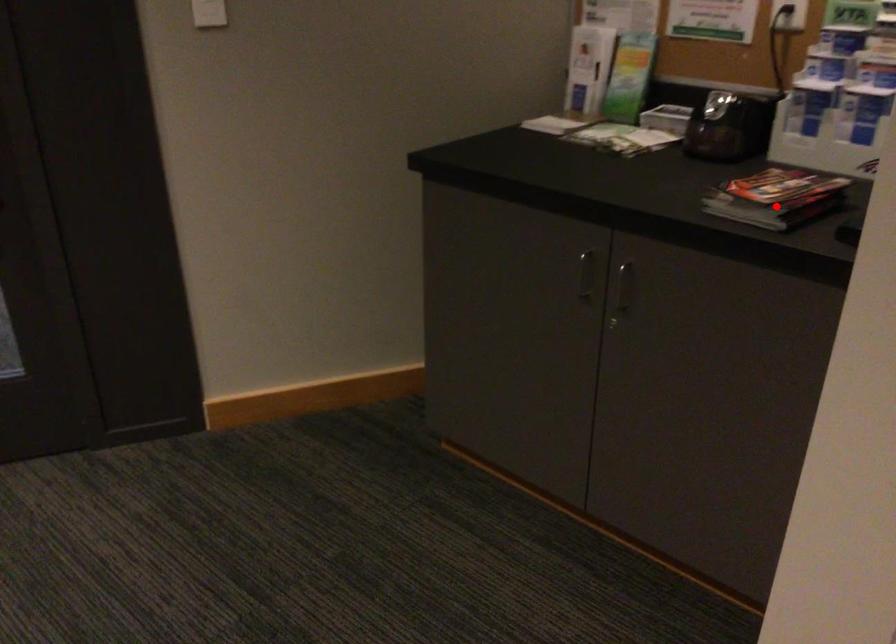
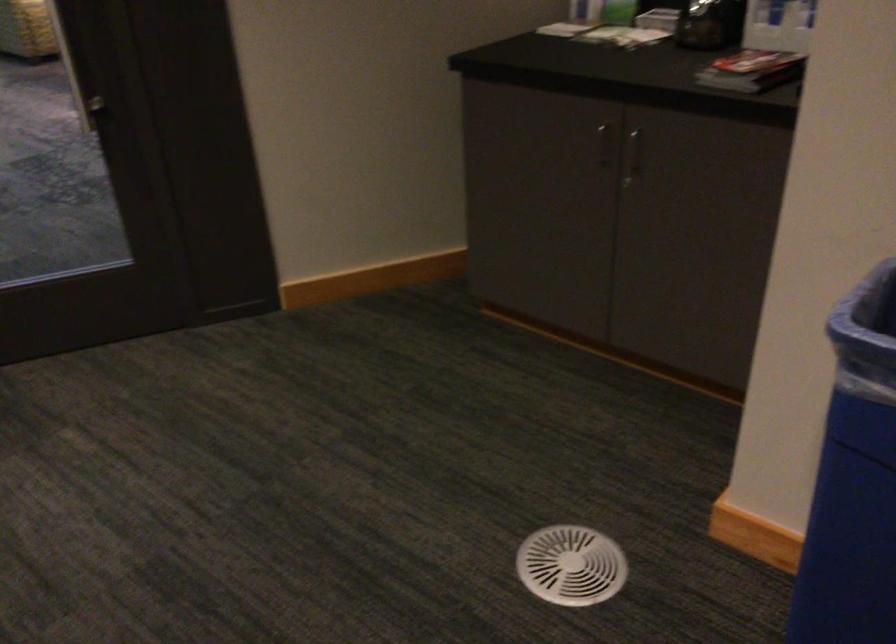
Question: I am providing you with two images of the same scene from different viewpoints. In image1, a red point is highlighted. Considering the same 3D point in image2, which of the following is correct?

Choices:
 (A) It is closer
 (B) It is farther

Answer: (B)